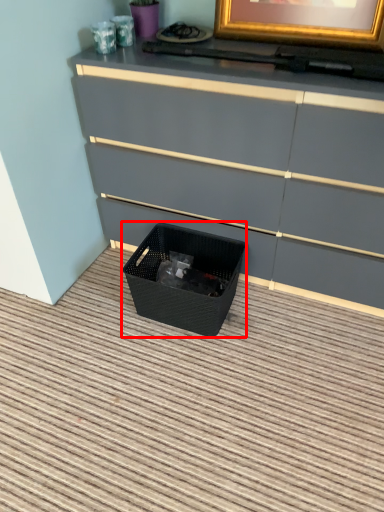
Question: From the image's perspective, where is basket container (annotated by the red box) located relative to chest of drawers?

Choices:
 (A) below
 (B) above

Answer: (A)